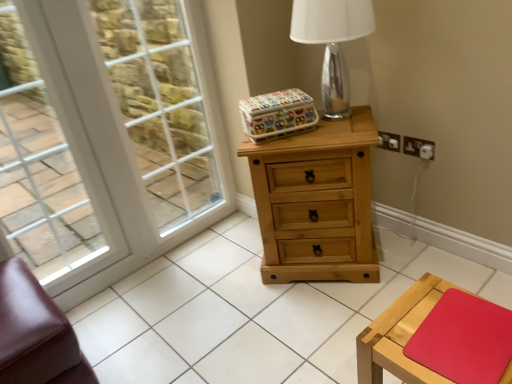
Where is `free space in front of natural wood chest of drawers at center`? Image resolution: width=512 pixels, height=384 pixels. free space in front of natural wood chest of drawers at center is located at coordinates (317, 318).